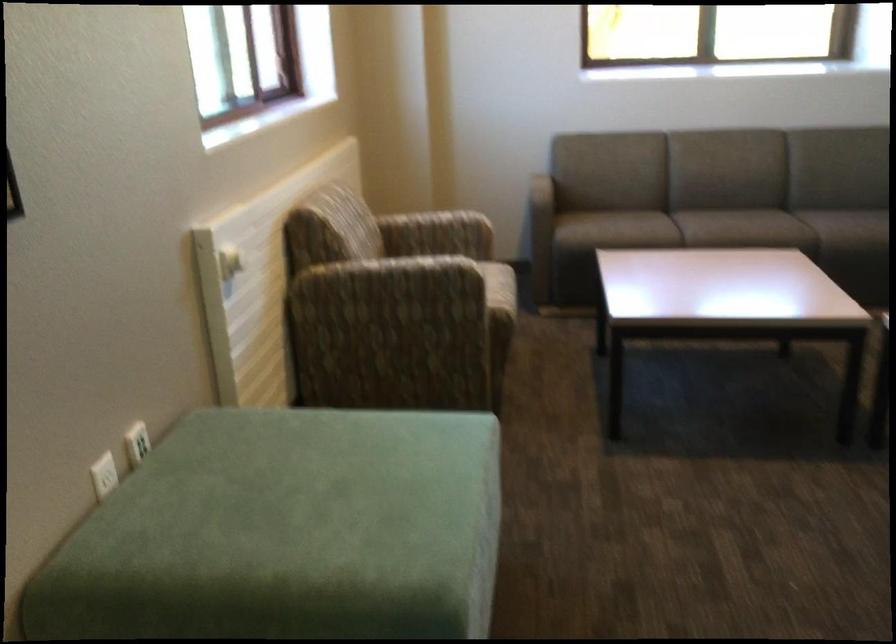
Locate an element on the screen. grey sofa armrest is located at coordinates (540, 234).